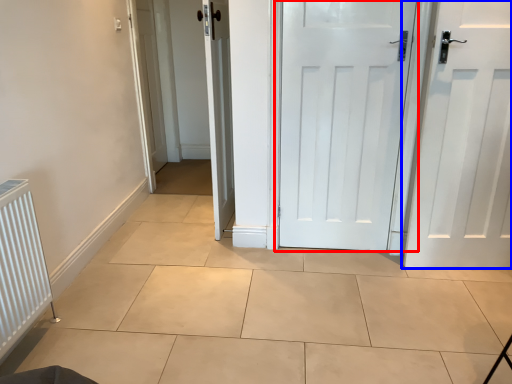
Question: Which of the following is the closest to the observer, door (highlighted by a red box) or door (highlighted by a blue box)?

Choices:
 (A) door
 (B) door

Answer: (B)